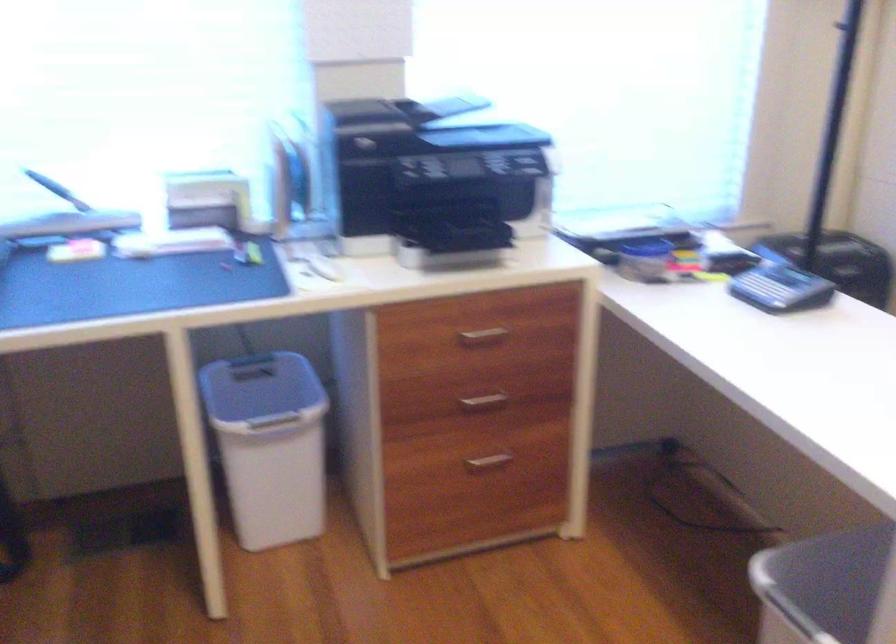
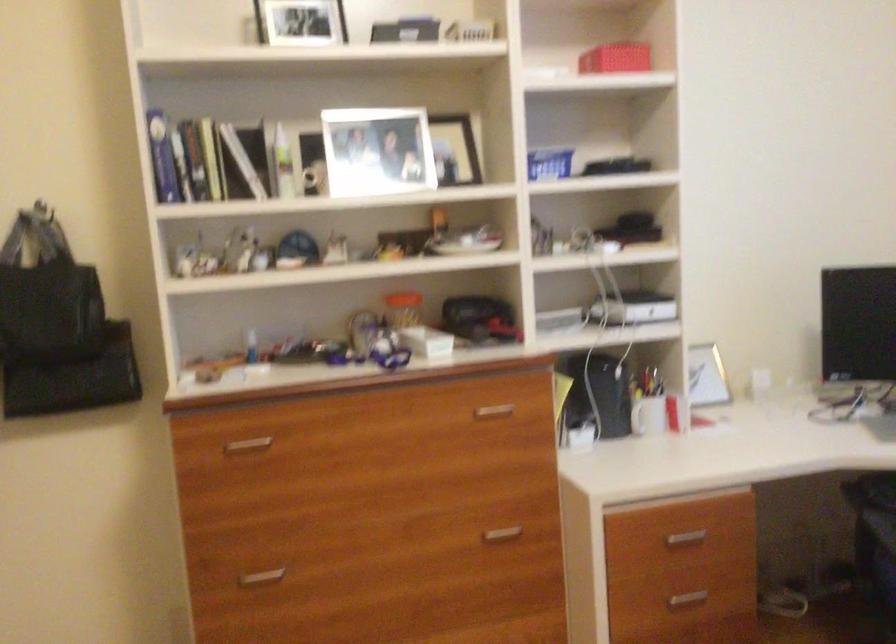
Question: The first image is from the beginning of the video and the second image is from the end. How did the camera likely rotate when shooting the video?

Choices:
 (A) Left
 (B) Right
 (C) Up
 (D) Down

Answer: (A)